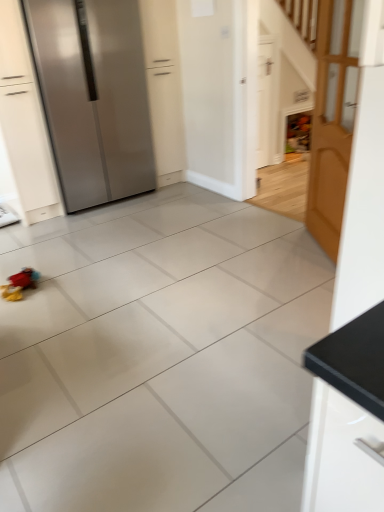
Question: Can you confirm if white matte door at upper right, which is the second door in front-to-back order, is bigger than wooden door at right, the 1th door viewed from the front?

Choices:
 (A) yes
 (B) no

Answer: (B)

Question: Is white matte door at upper right, which is the second door in front-to-back order, completely or partially outside of wooden door at right, the 1th door viewed from the front?

Choices:
 (A) no
 (B) yes

Answer: (B)

Question: Is there a large distance between white matte door at upper right, which appears as the 1th door when viewed from the back, and wooden door at right, the second door in the back-to-front sequence?

Choices:
 (A) no
 (B) yes

Answer: (B)

Question: Is wooden door at right, the 1th door viewed from the front, inside white matte door at upper right, which is the second door in front-to-back order?

Choices:
 (A) yes
 (B) no

Answer: (B)

Question: Is white matte door at upper right, which is the second door in front-to-back order, facing away from wooden door at right, the second door in the back-to-front sequence?

Choices:
 (A) no
 (B) yes

Answer: (A)

Question: Is white matte door at upper right, which is the second door in front-to-back order, wider or thinner than satin silver refrigerator at left?

Choices:
 (A) thin
 (B) wide

Answer: (A)

Question: Is white matte door at upper right, which appears as the 1th door when viewed from the back, taller or shorter than satin silver refrigerator at left?

Choices:
 (A) tall
 (B) short

Answer: (B)

Question: Relative to satin silver refrigerator at left, is white matte door at upper right, which appears as the 1th door when viewed from the back, in front or behind?

Choices:
 (A) behind
 (B) front

Answer: (A)

Question: From the image's perspective, is white matte door at upper right, which appears as the 1th door when viewed from the back, located above or below satin silver refrigerator at left?

Choices:
 (A) above
 (B) below

Answer: (A)

Question: From the image's perspective, relative to white matte door at upper right, which appears as the 1th door when viewed from the back, is satin silver refrigerator at left above or below?

Choices:
 (A) below
 (B) above

Answer: (A)

Question: Considering the positions of satin silver refrigerator at left and white matte door at upper right, which is the second door in front-to-back order, in the image, is satin silver refrigerator at left wider or thinner than white matte door at upper right, which is the second door in front-to-back order,?

Choices:
 (A) wide
 (B) thin

Answer: (A)

Question: Looking at the image, does satin silver refrigerator at left seem bigger or smaller compared to white matte door at upper right, which is the second door in front-to-back order?

Choices:
 (A) big
 (B) small

Answer: (A)

Question: Based on their positions, is satin silver refrigerator at left located to the left or right of white matte door at upper right, which appears as the 1th door when viewed from the back?

Choices:
 (A) right
 (B) left

Answer: (B)

Question: Looking at the image, does wooden door at right, the 1th door viewed from the front, seem bigger or smaller compared to satin silver refrigerator at left?

Choices:
 (A) big
 (B) small

Answer: (B)

Question: From a real-world perspective, relative to satin silver refrigerator at left, is wooden door at right, the second door in the back-to-front sequence, vertically above or below?

Choices:
 (A) above
 (B) below

Answer: (B)